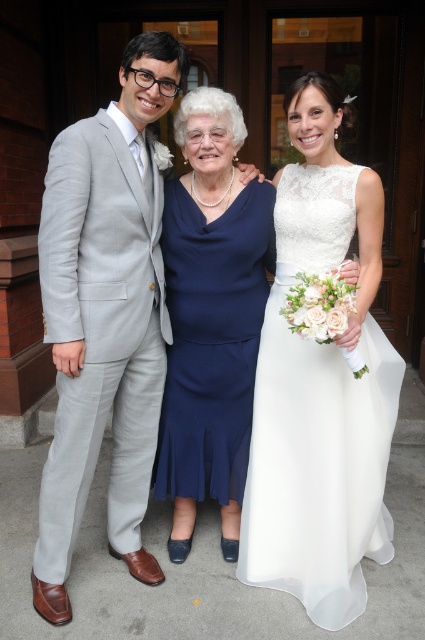
You are a photographer at a wedding and want to ensure all guests can see the couple during the ceremony. The white lace dress at center and the light gray suit at left are part of the wedding party. Which of these two has a wider silhouette to better accommodate visibility from the back?

The white lace dress at center has a larger width than the light gray suit at left, making it more visible from the back.

You are a photographer at a wedding and need to adjust the lighting for the couple. The white lace dress at center and the light gray suit at left are in the frame. Which clothing item requires more space in the frame to accommodate its size?

The white lace dress at center requires more space in the frame because it is bigger than the light gray suit at left.